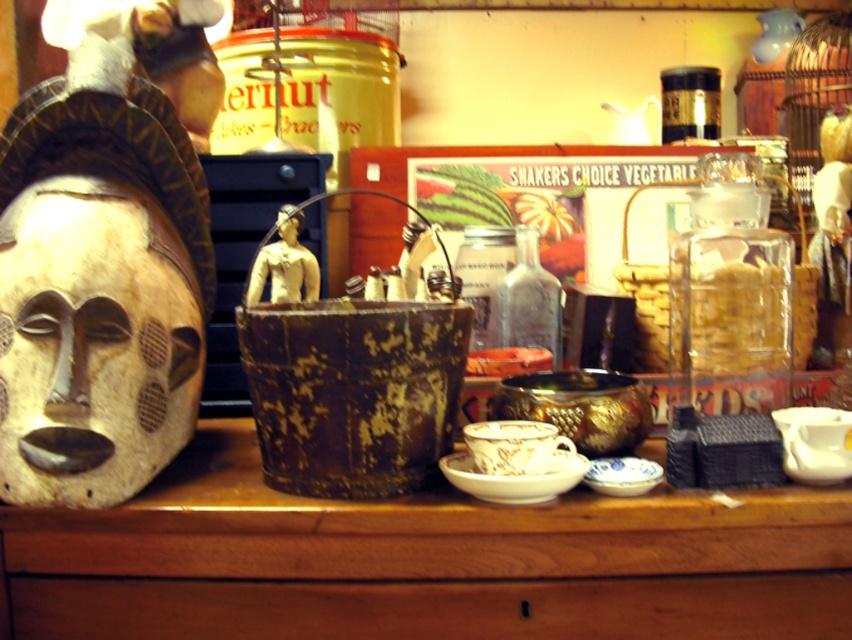
Who is positioned more to the left, wooden mask at left or matte yellow head at center?

wooden mask at left

Does point (101, 362) come closer to viewer compared to point (291, 209)?

Yes, it is.

I want to click on wooden mask at left, so click(x=93, y=342).

Is point (516, 636) farther from camera compared to point (297, 209)?

No.

Between point (660, 500) and point (301, 227), which one is positioned behind?

The point (301, 227) is more distant.

Is point (688, 608) closer to camera compared to point (295, 220)?

Yes, it is in front of point (295, 220).

I want to click on wooden table at center, so click(424, 561).

Image resolution: width=852 pixels, height=640 pixels. Describe the element at coordinates (424, 561) in the screenshot. I see `wooden table at center` at that location.

Does wooden table at center have a greater width compared to wooden mask at left?

Yes.

The image size is (852, 640). What are the coordinates of `wooden table at center` in the screenshot? It's located at (424, 561).